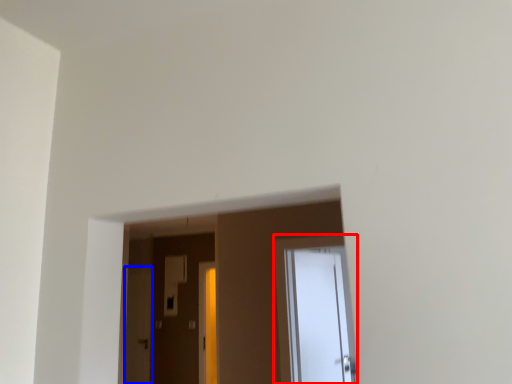
Question: Among these objects, which one is nearest to the camera, door (highlighted by a red box) or screen door (highlighted by a blue box)?

Choices:
 (A) door
 (B) screen door

Answer: (A)